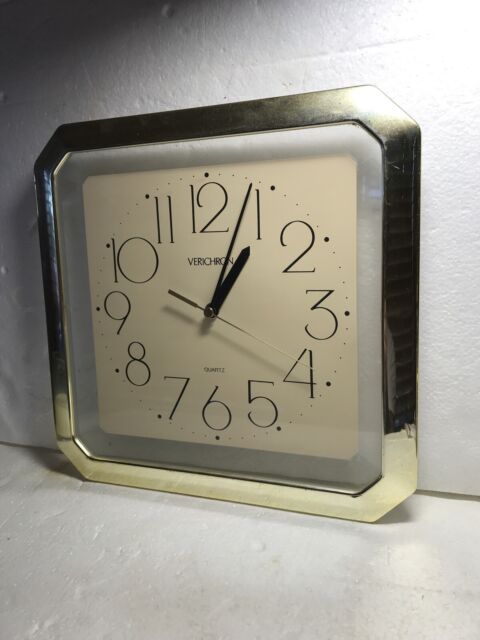
At what (x,y) coordinates should I click in order to perform the action: click on reflection on side of clock. Please return your answer as a coordinate pair (x, y). The image size is (480, 640). Looking at the image, I should click on (396, 358).